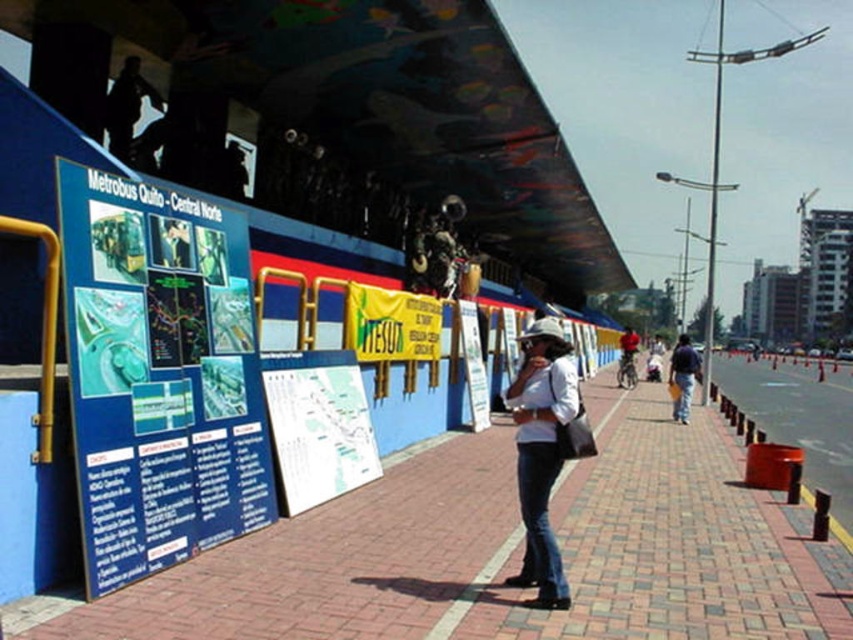
Where is `dark blue jeans at center`? dark blue jeans at center is located at coordinates point(683,378).

This screenshot has width=853, height=640. Describe the element at coordinates (683, 378) in the screenshot. I see `dark blue jeans at center` at that location.

At what (x,y) coordinates should I click in order to perform the action: click on dark blue jeans at center. Please return your answer as a coordinate pair (x, y). The image size is (853, 640). Looking at the image, I should click on (683, 378).

Is blue cardboard poster at left smaller than dark blue jeans at center?

Yes, blue cardboard poster at left is smaller than dark blue jeans at center.

Can you confirm if blue cardboard poster at left is wider than dark blue jeans at center?

In fact, blue cardboard poster at left might be narrower than dark blue jeans at center.

Between point (161, 488) and point (683, 381), which one is positioned behind?

The point (683, 381) is behind.

Locate an element on the screen. blue cardboard poster at left is located at coordinates (160, 376).

Where is `white matte shirt at center`? white matte shirt at center is located at coordinates (541, 451).

In the scene shown: Can you confirm if white matte shirt at center is positioned above red fabric jacket at center?

No, white matte shirt at center is not above red fabric jacket at center.

Is point (566, 385) farther from camera compared to point (619, 378)?

No, it is not.

You are a GUI agent. You are given a task and a screenshot of the screen. Output one action in this format:
    pyautogui.click(x=<x>, y=<y>)
    Task: Click on the white matte shirt at center
    
    Given the screenshot: What is the action you would take?
    pyautogui.click(x=541, y=451)